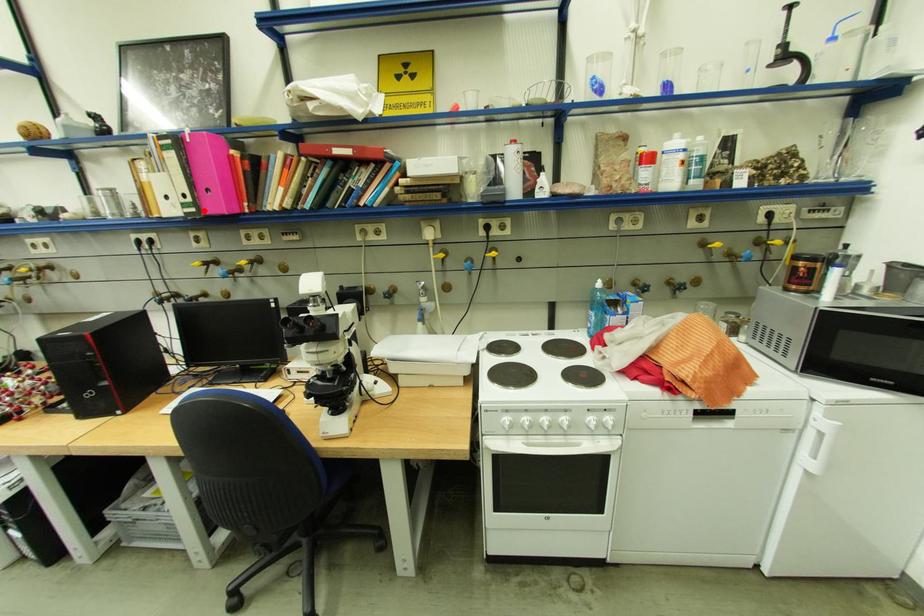
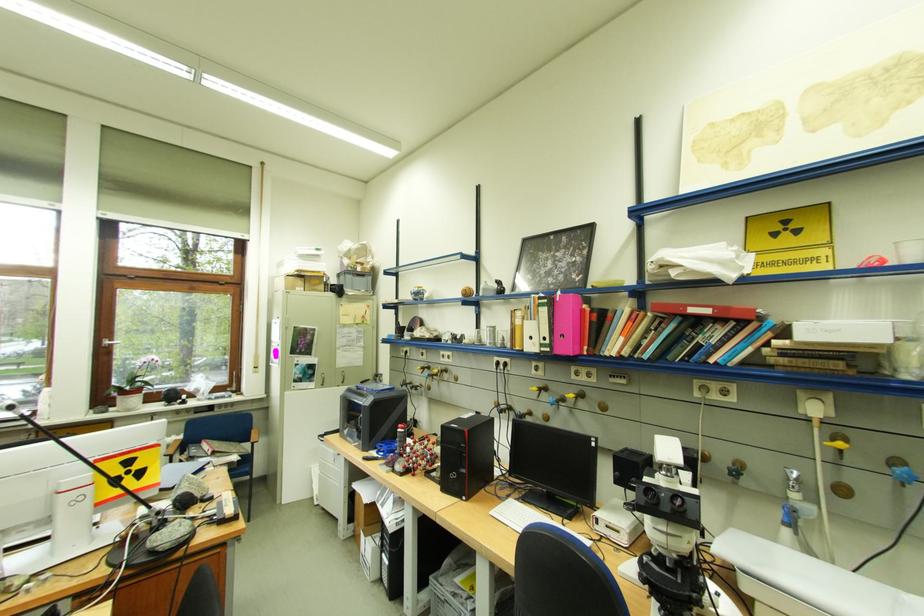
Locate, in the second image, the point that corresponds to the highlighted location in the first image.

(558, 351)